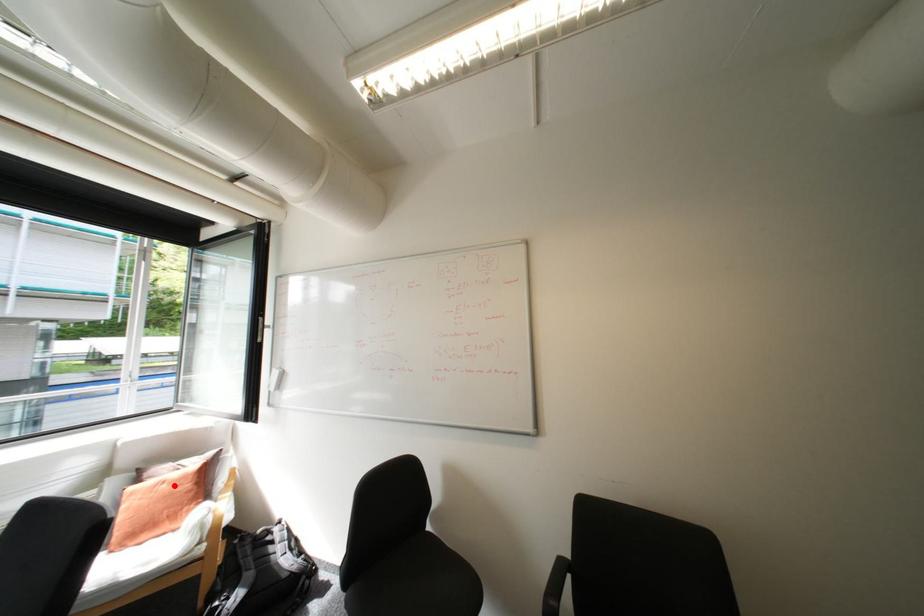
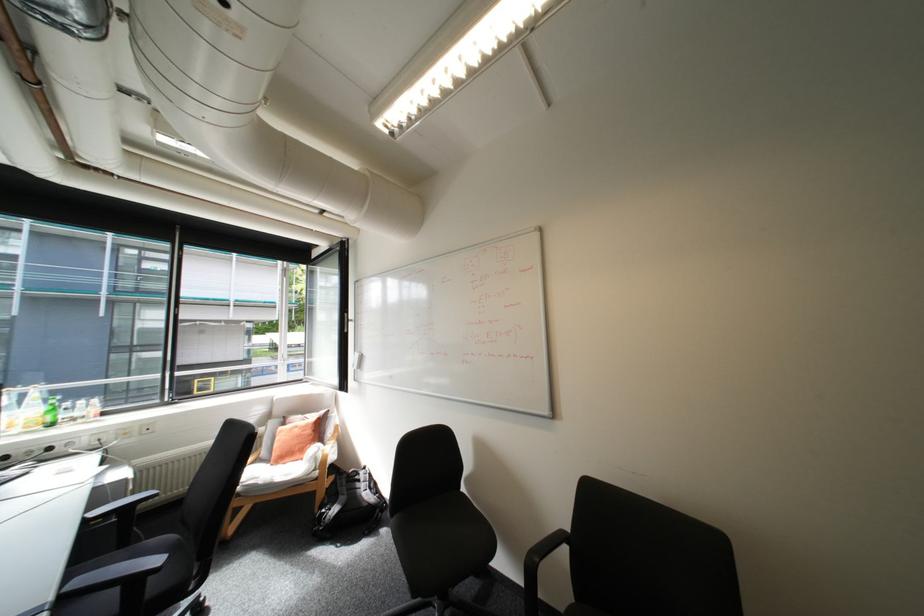
Question: I am providing you with two images of the same scene from different viewpoints. In image1, a red point is highlighted. Considering the same 3D point in image2, which of the following is correct?

Choices:
 (A) It is closer
 (B) It is farther

Answer: (B)